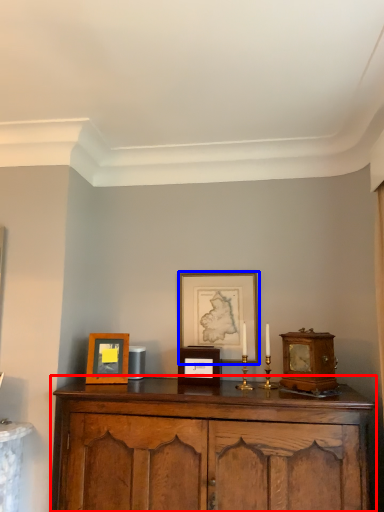
Question: Among these objects, which one is nearest to the camera, cabinetry (highlighted by a red box) or picture frame (highlighted by a blue box)?

Choices:
 (A) cabinetry
 (B) picture frame

Answer: (A)